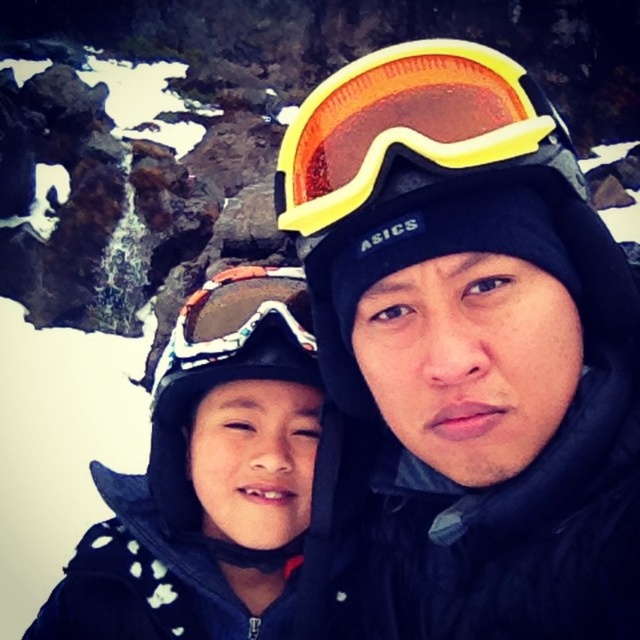
Which is more to the left, matte black ski goggles at center or yellow matte ski goggles at upper center?

From the viewer's perspective, yellow matte ski goggles at upper center appears more on the left side.

Which is below, matte black ski goggles at center or yellow matte ski goggles at upper center?

matte black ski goggles at center is below.

Who is more distant from viewer, [429,461] or [314,192]?

The point [429,461] is more distant.

Locate an element on the screen. This screenshot has width=640, height=640. matte black ski goggles at center is located at coordinates (461, 356).

Is point (470, 212) in front of point (189, 502)?

That is True.

Who is more forward, (x=408, y=356) or (x=280, y=448)?

Point (x=408, y=356)

What do you see at coordinates (461, 356) in the screenshot? The image size is (640, 640). I see `matte black ski goggles at center` at bounding box center [461, 356].

I want to click on matte black ski goggles at center, so click(x=461, y=356).

Who is positioned more to the right, white polka dot jacket at center or yellow matte ski goggles at upper center?

yellow matte ski goggles at upper center is more to the right.

Is white polka dot jacket at center closer to the viewer compared to yellow matte ski goggles at upper center?

No, white polka dot jacket at center is further to the viewer.

Describe the element at coordinates (208, 480) in the screenshot. The image size is (640, 640). I see `white polka dot jacket at center` at that location.

The width and height of the screenshot is (640, 640). What are the coordinates of `white polka dot jacket at center` in the screenshot? It's located at (208, 480).